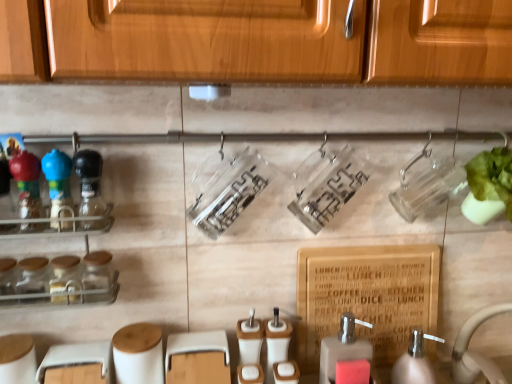
Question: Considering the relative sizes of white ceramic sink at lower right and clear glass spice rack at left in the image provided, is white ceramic sink at lower right smaller than clear glass spice rack at left?

Choices:
 (A) no
 (B) yes

Answer: (B)

Question: Is white ceramic sink at lower right thinner than clear glass spice rack at left?

Choices:
 (A) yes
 (B) no

Answer: (B)

Question: Is white ceramic sink at lower right not within clear glass spice rack at left?

Choices:
 (A) yes
 (B) no

Answer: (A)

Question: Is white ceramic sink at lower right far away from clear glass spice rack at left?

Choices:
 (A) no
 (B) yes

Answer: (A)

Question: Is white ceramic sink at lower right behind clear glass spice rack at left?

Choices:
 (A) yes
 (B) no

Answer: (A)

Question: Would you say clear glass spice rack at left is to the left or to the right of blue glossy bottle at left, which is the 3th bottle in right-to-left order, in the picture?

Choices:
 (A) right
 (B) left

Answer: (B)

Question: From their relative heights in the image, would you say clear glass spice rack at left is taller or shorter than blue glossy bottle at left, which is the 3th bottle in right-to-left order?

Choices:
 (A) short
 (B) tall

Answer: (B)

Question: Is point 52,172 closer or farther from the camera than point 70,215?

Choices:
 (A) farther
 (B) closer

Answer: (B)

Question: Looking at their shapes, would you say clear glass spice rack at left is wider or thinner than blue glossy bottle at left, which is the 1th bottle in left-to-right order?

Choices:
 (A) thin
 (B) wide

Answer: (B)

Question: Is point (55, 200) positioned closer to the camera than point (71, 273)?

Choices:
 (A) closer
 (B) farther

Answer: (A)

Question: Considering the positions of blue glossy bottle at left, which is the 3th bottle in right-to-left order, and clear glass spice rack at left in the image, is blue glossy bottle at left, which is the 3th bottle in right-to-left order, bigger or smaller than clear glass spice rack at left?

Choices:
 (A) big
 (B) small

Answer: (B)

Question: Is blue glossy bottle at left, which is the 1th bottle in left-to-right order, taller or shorter than clear glass spice rack at left?

Choices:
 (A) tall
 (B) short

Answer: (B)

Question: Is blue glossy bottle at left, which is the 3th bottle in right-to-left order, situated inside clear glass spice rack at left or outside?

Choices:
 (A) inside
 (B) outside

Answer: (A)

Question: Based on their sizes in the image, would you say white plastic soap dispenser at lower right, arranged as the 1th soap dispenser when viewed from the right, is bigger or smaller than blue glossy bottle at left, which is the 3th bottle in right-to-left order?

Choices:
 (A) big
 (B) small

Answer: (A)

Question: Considering their positions, is white plastic soap dispenser at lower right, arranged as the 1th soap dispenser when viewed from the right, located in front of or behind blue glossy bottle at left, which is the 3th bottle in right-to-left order?

Choices:
 (A) behind
 (B) front

Answer: (A)